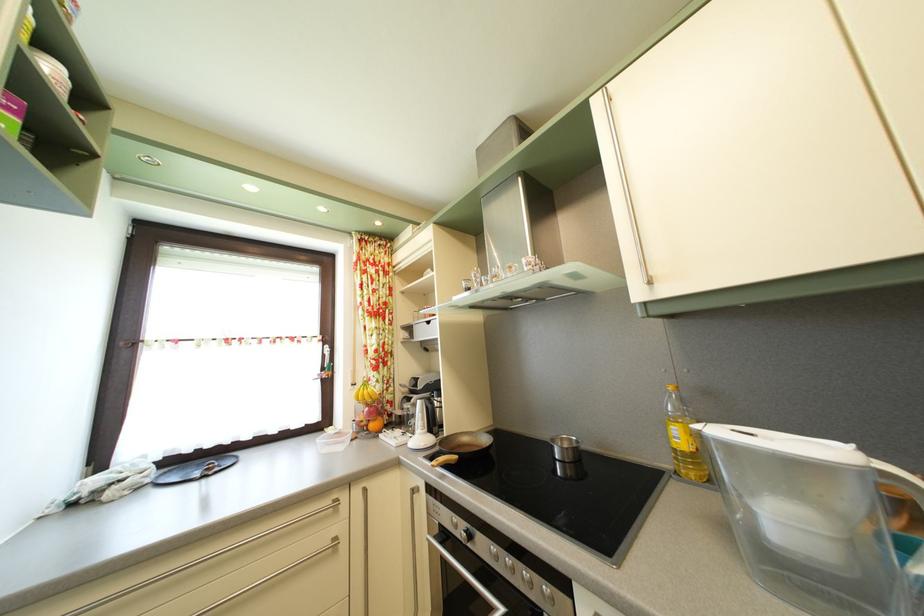
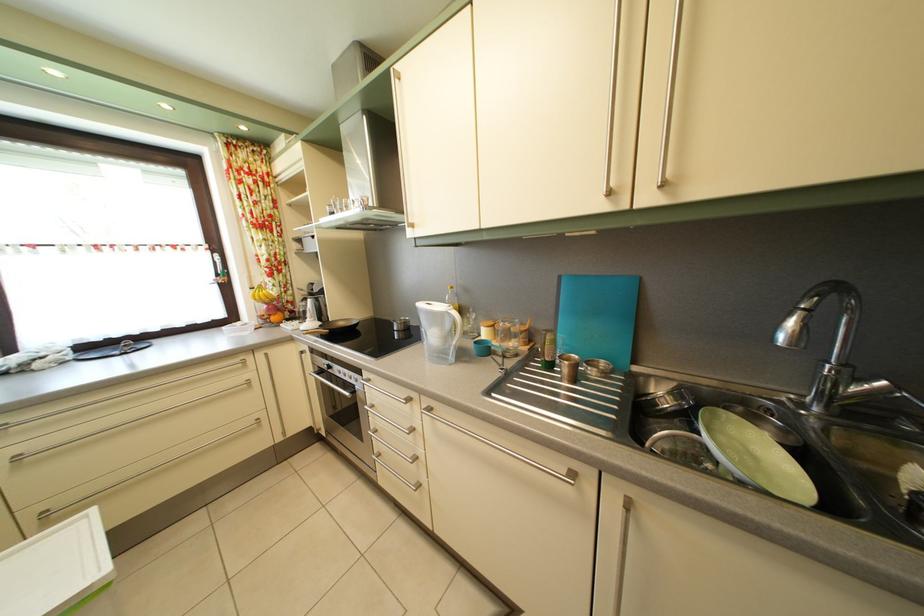
In the second image, find the point that corresponds to point (407, 439) in the first image.

(305, 330)